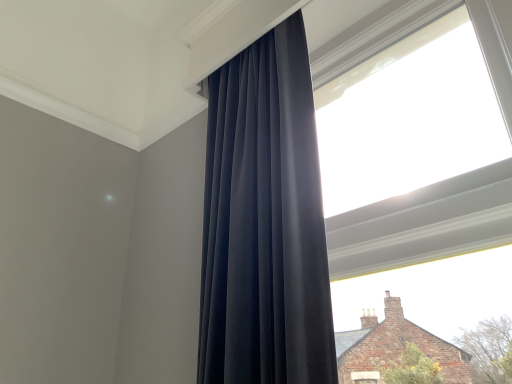
Question: Should I look upward or downward to see transparent glass window at upper center?

Choices:
 (A) up
 (B) down

Answer: (A)

Question: Considering the relative sizes of matte black curtain at center and transparent glass window at upper center in the image provided, is matte black curtain at center wider than transparent glass window at upper center?

Choices:
 (A) yes
 (B) no

Answer: (A)

Question: Is matte black curtain at center further to the viewer compared to transparent glass window at upper center?

Choices:
 (A) yes
 (B) no

Answer: (A)

Question: Does matte black curtain at center have a lesser height compared to transparent glass window at upper center?

Choices:
 (A) yes
 (B) no

Answer: (A)

Question: Considering the relative positions of matte black curtain at center and transparent glass window at upper center in the image provided, is matte black curtain at center in front of transparent glass window at upper center?

Choices:
 (A) no
 (B) yes

Answer: (A)

Question: From a real-world perspective, is matte black curtain at center physically above transparent glass window at upper center?

Choices:
 (A) no
 (B) yes

Answer: (A)

Question: Is matte black curtain at center facing away from transparent glass window at upper center?

Choices:
 (A) no
 (B) yes

Answer: (A)

Question: Is transparent glass window at upper center looking in the opposite direction of matte black curtain at center?

Choices:
 (A) no
 (B) yes

Answer: (A)

Question: From the image's perspective, is transparent glass window at upper center under matte black curtain at center?

Choices:
 (A) yes
 (B) no

Answer: (B)

Question: From a real-world perspective, is transparent glass window at upper center on top of matte black curtain at center?

Choices:
 (A) yes
 (B) no

Answer: (A)

Question: Can you confirm if transparent glass window at upper center is thinner than matte black curtain at center?

Choices:
 (A) no
 (B) yes

Answer: (B)

Question: Is transparent glass window at upper center far away from matte black curtain at center?

Choices:
 (A) no
 (B) yes

Answer: (A)

Question: Does transparent glass window at upper center have a smaller size compared to matte black curtain at center?

Choices:
 (A) yes
 (B) no

Answer: (A)

Question: Is matte black curtain at center bigger or smaller than transparent glass window at upper center?

Choices:
 (A) big
 (B) small

Answer: (A)